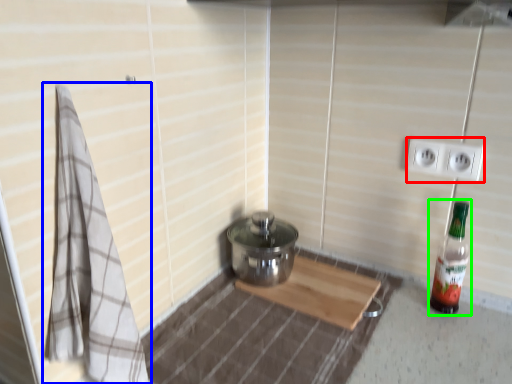
Question: Which object is the farthest from electric outlet (highlighted by a red box)? Choose among these: bath towel (highlighted by a blue box) or bottle (highlighted by a green box).

Choices:
 (A) bath towel
 (B) bottle

Answer: (A)